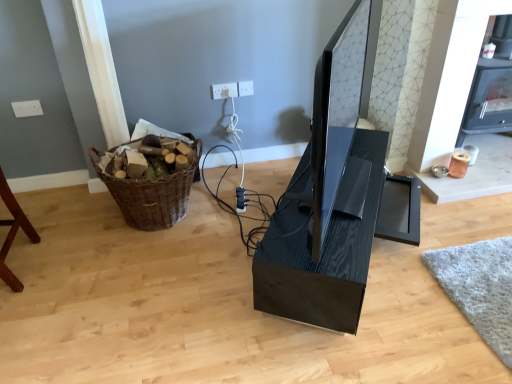
Locate an element on the screen. Image resolution: width=512 pixels, height=384 pixels. matte black monitor at center is located at coordinates (336, 114).

Find the location of a particular element. This screenshot has width=512, height=384. woven brown basket at left is located at coordinates (150, 197).

Image resolution: width=512 pixels, height=384 pixels. What do you see at coordinates (322, 254) in the screenshot? I see `black glossy computer desk at center` at bounding box center [322, 254].

Where is `white plastic electric outlet at upper center, which ranks as the 2th electric outlet in left-to-right order`? The image size is (512, 384). white plastic electric outlet at upper center, which ranks as the 2th electric outlet in left-to-right order is located at coordinates (245, 88).

In order to face white plastic electric outlet at upper center, which ranks as the 2th electric outlet in left-to-right order, should I rotate leftwards or rightwards?

Turn left by 1.405 degrees to look at white plastic electric outlet at upper center, which ranks as the 2th electric outlet in left-to-right order.

At what (x,y) coordinates should I click in order to perform the action: click on matte black monitor at center. Please return your answer as a coordinate pair (x, y). Looking at the image, I should click on [x=336, y=114].

Is woven brown basket at left surrounded by black plastic plug at center?

Definitely not — woven brown basket at left is not inside black plastic plug at center.

Is black plastic plug at center to the right of woven brown basket at left from the viewer's perspective?

Correct, you'll find black plastic plug at center to the right of woven brown basket at left.

Can you tell me how much black plastic plug at center and woven brown basket at left differ in facing direction?

The facing directions of black plastic plug at center and woven brown basket at left are 81.3 degrees apart.

Is point (242, 198) positioned after point (113, 192)?

Yes, point (242, 198) is farther from viewer.

Considering the relative sizes of woven brown basket at left and black plastic plug at center in the image provided, is woven brown basket at left smaller than black plastic plug at center?

Incorrect, woven brown basket at left is not smaller in size than black plastic plug at center.

Between point (120, 202) and point (236, 194), which one is positioned in front?

Positioned in front is point (120, 202).

Considering the sizes of objects woven brown basket at left and black plastic plug at center in the image provided, who is thinner, woven brown basket at left or black plastic plug at center?

Thinner between the two is black plastic plug at center.

From the image's perspective, is woven brown basket at left positioned above or below black plastic plug at center?

From the image's perspective, woven brown basket at left appears above black plastic plug at center.

Consider the image. Does white plastic electric outlet at upper center, which appears as the 1th electric outlet when viewed from the right, turn towards black glossy computer desk at center?

Yes, white plastic electric outlet at upper center, which appears as the 1th electric outlet when viewed from the right, is aimed at black glossy computer desk at center.

Does white plastic electric outlet at upper center, which ranks as the 2th electric outlet in left-to-right order, contain black glossy computer desk at center?

No, black glossy computer desk at center is not surrounded by white plastic electric outlet at upper center, which ranks as the 2th electric outlet in left-to-right order.

Where is `computer desk that is below the white plastic electric outlet at upper center, which appears as the 1th electric outlet when viewed from the right (from the image's perspective)`? Image resolution: width=512 pixels, height=384 pixels. computer desk that is below the white plastic electric outlet at upper center, which appears as the 1th electric outlet when viewed from the right (from the image's perspective) is located at coordinates (322, 254).

Between white plastic electric outlet at upper center, which ranks as the 2th electric outlet in left-to-right order, and black glossy computer desk at center, which one has smaller size?

With smaller size is white plastic electric outlet at upper center, which ranks as the 2th electric outlet in left-to-right order.

Can you confirm if white plastic electric outlet at upper center, the 1th electric outlet viewed from the left, is bigger than woven brown basket at left?

No.

Based on their positions, is white plastic electric outlet at upper center, the 1th electric outlet viewed from the left, located to the left or right of woven brown basket at left?

white plastic electric outlet at upper center, the 1th electric outlet viewed from the left, is to the right of woven brown basket at left.

Can you confirm if white plastic electric outlet at upper center, the 1th electric outlet viewed from the left, is wider than woven brown basket at left?

No.

Does matte black monitor at center have a greater height compared to woven brown basket at left?

Correct, matte black monitor at center is much taller as woven brown basket at left.

Are matte black monitor at center and woven brown basket at left making contact?

No, matte black monitor at center is not touching woven brown basket at left.

Does matte black monitor at center turn towards woven brown basket at left?

No, matte black monitor at center is not facing towards woven brown basket at left.

Locate an element on the screen. electric outlet that appears on the right of black plastic plug at center is located at coordinates (245, 88).

How distant is black plastic plug at center from white plastic electric outlet at upper center, which appears as the 1th electric outlet when viewed from the right?

black plastic plug at center and white plastic electric outlet at upper center, which appears as the 1th electric outlet when viewed from the right, are 64.49 centimeters apart from each other.

In the scene shown: Is black plastic plug at center aimed at white plastic electric outlet at upper center, which appears as the 1th electric outlet when viewed from the right?

No, black plastic plug at center is not oriented towards white plastic electric outlet at upper center, which appears as the 1th electric outlet when viewed from the right.

What's the angular difference between black plastic plug at center and white plastic electric outlet at upper center, which ranks as the 2th electric outlet in left-to-right order,'s facing directions?

black plastic plug at center and white plastic electric outlet at upper center, which ranks as the 2th electric outlet in left-to-right order, are facing 77.7 degrees away from each other.

Could you measure the distance between black plastic plug at center and white plastic electric outlet at upper center, the 1th electric outlet viewed from the left?

black plastic plug at center and white plastic electric outlet at upper center, the 1th electric outlet viewed from the left, are 62.05 centimeters apart from each other.

In terms of size, does black plastic plug at center appear bigger or smaller than white plastic electric outlet at upper center, the 2th electric outlet when ordered from right to left?

Clearly, black plastic plug at center is larger in size than white plastic electric outlet at upper center, the 2th electric outlet when ordered from right to left.

Considering the points (243, 202) and (223, 85), which point is behind, point (243, 202) or point (223, 85)?

The point (223, 85) is more distant.

Considering the sizes of black plastic plug at center and white plastic electric outlet at upper center, the 2th electric outlet when ordered from right to left, in the image, is black plastic plug at center taller or shorter than white plastic electric outlet at upper center, the 2th electric outlet when ordered from right to left,?

black plastic plug at center is shorter than white plastic electric outlet at upper center, the 2th electric outlet when ordered from right to left.

What are the coordinates of `plug below the woven brown basket at left (from the image's perspective)` in the screenshot? It's located at (240, 200).

What are the coordinates of `plug on the right of woven brown basket at left` in the screenshot? It's located at (240, 200).

Based on the photo, which object lies nearer to the anchor point woven brown basket at left, white plastic electric outlet at upper center, the 2th electric outlet when ordered from right to left, or black glossy computer desk at center?

white plastic electric outlet at upper center, the 2th electric outlet when ordered from right to left, lies closer to woven brown basket at left than the other object.

Which object lies further to the anchor point black glossy computer desk at center, matte black monitor at center or white plastic electric outlet at upper center, which ranks as the 2th electric outlet in left-to-right order?

Based on the image, white plastic electric outlet at upper center, which ranks as the 2th electric outlet in left-to-right order, appears to be further to black glossy computer desk at center.

In the scene shown: Which object lies further to the anchor point white plastic electric outlet at upper center, which ranks as the 2th electric outlet in left-to-right order, woven brown basket at left or black glossy computer desk at center?

black glossy computer desk at center.

In the scene shown: Estimate the real-world distances between objects in this image. Which object is further from woven brown basket at left, black plastic plug at center or matte black monitor at center?

The object further to woven brown basket at left is matte black monitor at center.

Considering their positions, is black glossy computer desk at center positioned closer to white plastic electric outlet at upper center, the 2th electric outlet when ordered from right to left, than matte black monitor at center?

matte black monitor at center is positioned closer to the anchor white plastic electric outlet at upper center, the 2th electric outlet when ordered from right to left.

In the scene shown: Estimate the real-world distances between objects in this image. Which object is further from white plastic electric outlet at upper center, the 1th electric outlet viewed from the left, black plastic plug at center or black glossy computer desk at center?

black glossy computer desk at center is positioned further to the anchor white plastic electric outlet at upper center, the 1th electric outlet viewed from the left.

Estimate the real-world distances between objects in this image. Which object is closer to white plastic electric outlet at upper center, which appears as the 1th electric outlet when viewed from the right, white plastic electric outlet at upper center, the 1th electric outlet viewed from the left, or woven brown basket at left?

The object closer to white plastic electric outlet at upper center, which appears as the 1th electric outlet when viewed from the right, is white plastic electric outlet at upper center, the 1th electric outlet viewed from the left.

Looking at the image, which one is located further to black glossy computer desk at center, woven brown basket at left or black plastic plug at center?

woven brown basket at left.

Identify the location of computer desk positioned between matte black monitor at center and white plastic electric outlet at upper center, the 2th electric outlet when ordered from right to left, from near to far. The width and height of the screenshot is (512, 384). (322, 254).

Identify the location of basket positioned between matte black monitor at center and white plastic electric outlet at upper center, the 1th electric outlet viewed from the left, from near to far. The height and width of the screenshot is (384, 512). (150, 197).

Locate an element on the screen. This screenshot has height=384, width=512. basket between matte black monitor at center and black plastic plug at center in the front-back direction is located at coordinates (150, 197).

What are the coordinates of `basket between white plastic electric outlet at upper center, which ranks as the 2th electric outlet in left-to-right order, and black plastic plug at center from top to bottom` in the screenshot? It's located at (150, 197).